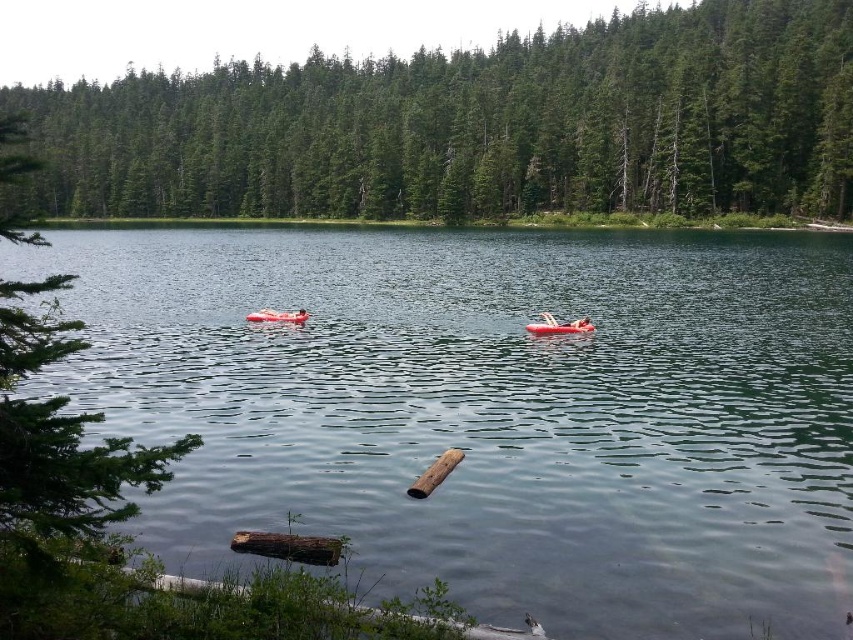
Does clear water at center come in front of brown rough log at lower center?

Yes.

Who is more distant from viewer, (517, 394) or (310, 545)?

The point (517, 394) is more distant.

At what (x,y) coordinates should I click in order to perform the action: click on clear water at center. Please return your answer as a coordinate pair (x, y). The height and width of the screenshot is (640, 853). Looking at the image, I should click on (491, 412).

Which is behind, point (305, 548) or point (248, 314)?

Point (248, 314)

Which is in front, point (271, 536) or point (248, 317)?

Point (271, 536) is in front.

You are a GUI agent. You are given a task and a screenshot of the screen. Output one action in this format:
    pyautogui.click(x=<x>, y=<y>)
    Task: Click on the brown rough log at lower center
    The image size is (853, 640).
    Given the screenshot: What is the action you would take?
    pyautogui.click(x=288, y=547)

Which is below, brown wood log at center or orange rubber boat at center?

Positioned lower is brown wood log at center.

Who is taller, brown wood log at center or orange rubber boat at center?

Standing taller between the two is orange rubber boat at center.

Find the location of a particular element. brown wood log at center is located at coordinates (434, 474).

At what (x,y) coordinates should I click in order to perform the action: click on brown wood log at center. Please return your answer as a coordinate pair (x, y). Image resolution: width=853 pixels, height=640 pixels. Looking at the image, I should click on (434, 474).